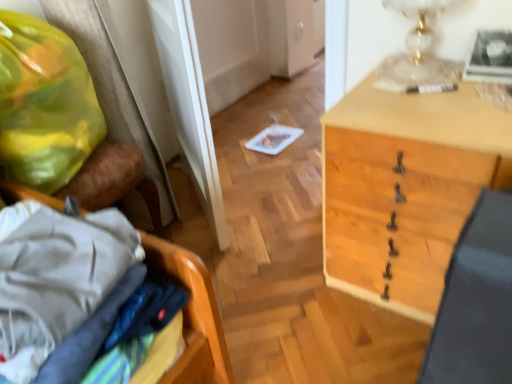
The height and width of the screenshot is (384, 512). Find the location of `free space in front of white glass table lamp at upper right`. free space in front of white glass table lamp at upper right is located at coordinates (422, 104).